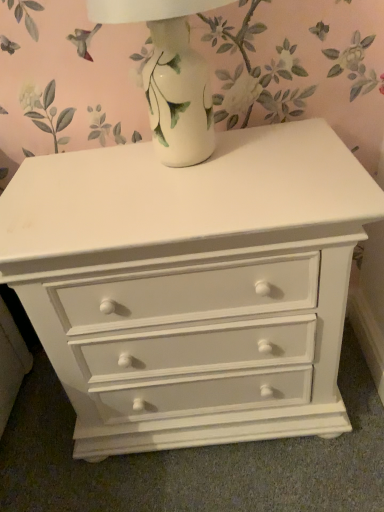
Question: Should I look upward or downward to see white glossy vase at upper center?

Choices:
 (A) down
 (B) up

Answer: (B)

Question: Is white glossy vase at upper center oriented away from white painted wood chest of drawers at center?

Choices:
 (A) yes
 (B) no

Answer: (B)

Question: Can white painted wood chest of drawers at center be found inside white glossy vase at upper center?

Choices:
 (A) yes
 (B) no

Answer: (B)

Question: From the image's perspective, is white glossy vase at upper center located above white painted wood chest of drawers at center?

Choices:
 (A) yes
 (B) no

Answer: (A)

Question: Is white glossy vase at upper center at the left side of white painted wood chest of drawers at center?

Choices:
 (A) no
 (B) yes

Answer: (B)

Question: From the image's perspective, is white glossy vase at upper center below white painted wood chest of drawers at center?

Choices:
 (A) no
 (B) yes

Answer: (A)

Question: From a real-world perspective, is white glossy vase at upper center on top of white painted wood chest of drawers at center?

Choices:
 (A) no
 (B) yes

Answer: (B)

Question: Is white painted wood chest of drawers at center positioned beyond the bounds of white glossy vase at upper center?

Choices:
 (A) yes
 (B) no

Answer: (A)

Question: Can you confirm if white painted wood chest of drawers at center is wider than white glossy vase at upper center?

Choices:
 (A) no
 (B) yes

Answer: (B)

Question: Is white painted wood chest of drawers at center facing towards white glossy vase at upper center?

Choices:
 (A) yes
 (B) no

Answer: (B)

Question: Can you confirm if white painted wood chest of drawers at center is bigger than white glossy vase at upper center?

Choices:
 (A) yes
 (B) no

Answer: (A)

Question: From the image's perspective, would you say white painted wood chest of drawers at center is positioned over white glossy vase at upper center?

Choices:
 (A) no
 (B) yes

Answer: (A)

Question: Is the position of white painted wood chest of drawers at center more distant than that of white glossy vase at upper center?

Choices:
 (A) yes
 (B) no

Answer: (A)

Question: From a real-world perspective, is white glossy vase at upper center above or below white painted wood chest of drawers at center?

Choices:
 (A) below
 (B) above

Answer: (B)